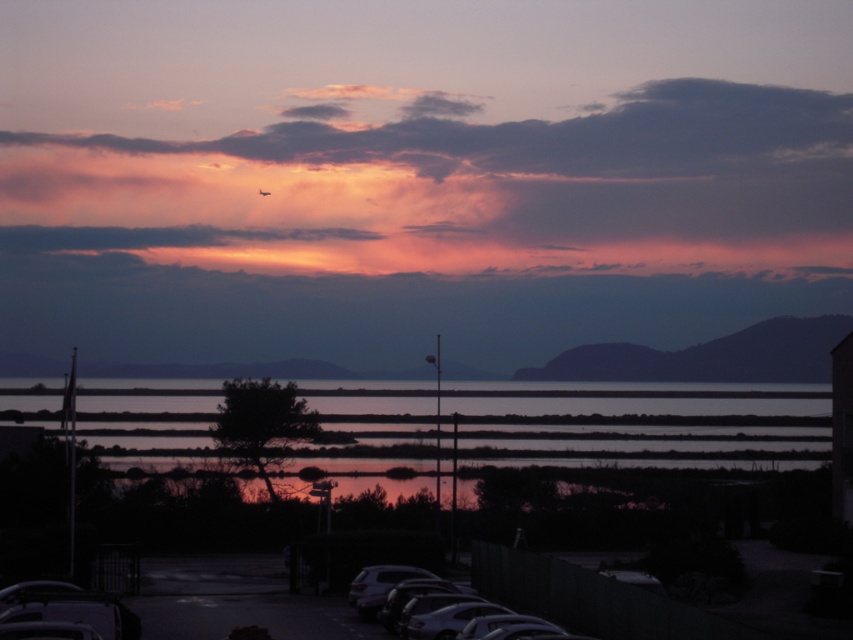
Question: Is metallic silver car at lower center thinner than matte white car at lower center?

Choices:
 (A) yes
 (B) no

Answer: (B)

Question: Estimate the real-world distances between objects in this image. Which object is farther from the matte white car at lower center?

Choices:
 (A) silvery reflective water at center
 (B) metallic silver car at lower center
 (C) matte pink cloud at upper center

Answer: (C)

Question: Which of the following is the farthest from the observer?

Choices:
 (A) matte pink cloud at upper center
 (B) silvery reflective water at center
 (C) metallic silver car at lower center
 (D) matte white car at lower center

Answer: (A)

Question: Can you confirm if silvery reflective water at center is smaller than metallic silver car at lower center?

Choices:
 (A) yes
 (B) no

Answer: (B)

Question: Which object is positioned farthest from the metallic silver car at lower center?

Choices:
 (A) matte white car at lower center
 (B) silvery reflective water at center
 (C) matte pink cloud at upper center

Answer: (C)

Question: Does matte pink cloud at upper center have a larger size compared to matte white car at lower center?

Choices:
 (A) no
 (B) yes

Answer: (B)